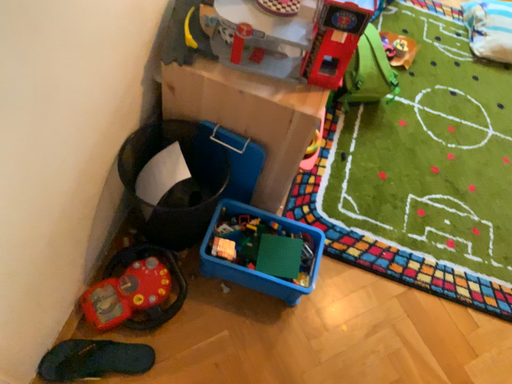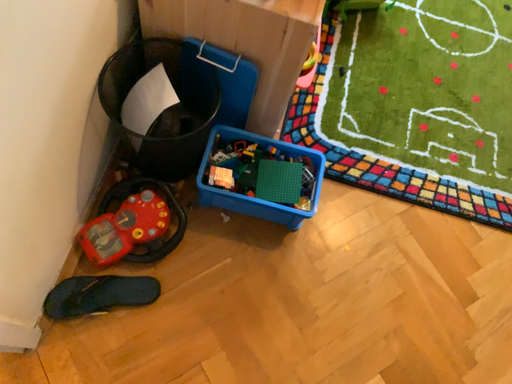
Question: Which way did the camera rotate in the video?

Choices:
 (A) rotated upward
 (B) rotated downward

Answer: (B)